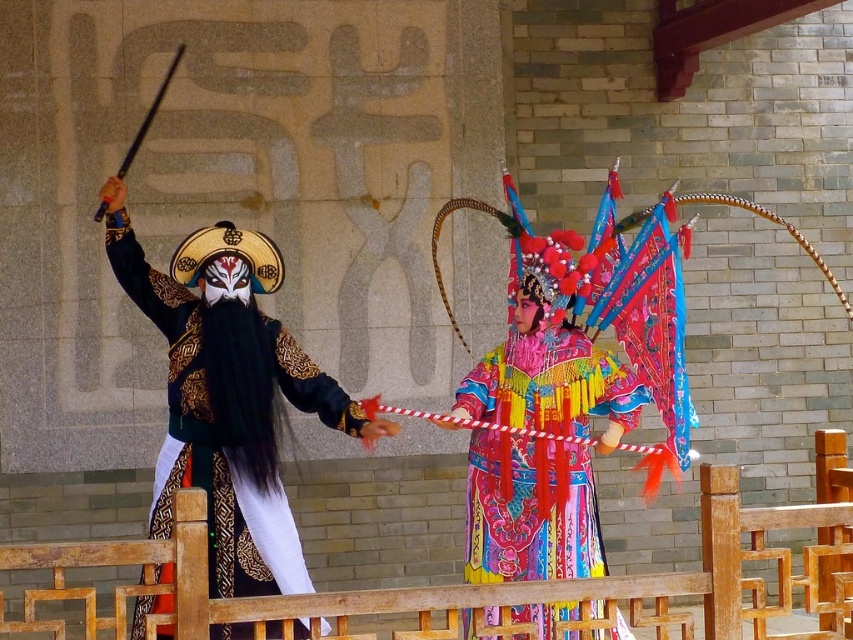
Measure the distance between point (233, 580) and camera.

Point (233, 580) is 8.64 meters away from camera.

Between black satin mask at left and vibrant silk robe at center, which one appears on the left side from the viewer's perspective?

From the viewer's perspective, black satin mask at left appears more on the left side.

What are the coordinates of `black satin mask at left` in the screenshot? It's located at (227, 420).

What are the coordinates of `black satin mask at left` in the screenshot? It's located at (227, 420).